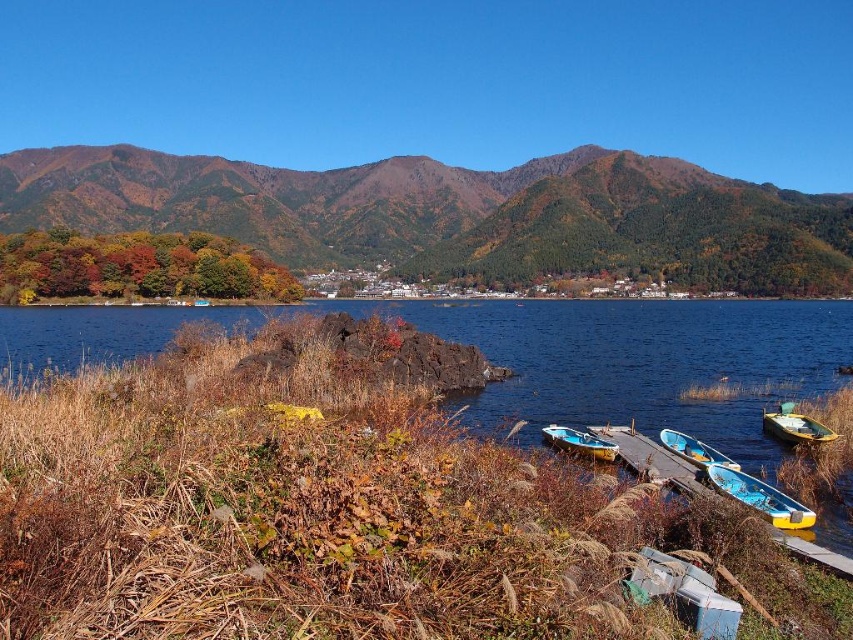
Who is more distant from viewer, (782, 497) or (660, 429)?

The point (660, 429) is more distant.

Is blue glossy canoe at lower right to the right of blue painted wooden canoe at lower center from the viewer's perspective?

No, blue glossy canoe at lower right is not to the right of blue painted wooden canoe at lower center.

Which is in front, point (746, 481) or point (694, 445)?

Point (746, 481)

The image size is (853, 640). What are the coordinates of `blue glossy canoe at lower right` in the screenshot? It's located at (759, 497).

Who is shorter, autumn foliage mountain at upper center or blue painted wooden canoe at lower center?

Standing shorter between the two is blue painted wooden canoe at lower center.

Is point (837, 218) farther from viewer compared to point (683, 456)?

Yes, it is.

Where is `autumn foliage mountain at upper center`? This screenshot has width=853, height=640. autumn foliage mountain at upper center is located at coordinates (456, 214).

Identify the location of autumn foliage mountain at upper center. [x=456, y=214].

Between point (790, 330) and point (697, 445), which one is positioned behind?

The point (790, 330) is more distant.

Can you confirm if blue water at lower center is smaller than blue painted wooden canoe at lower center?

Actually, blue water at lower center might be larger than blue painted wooden canoe at lower center.

Locate an element on the screen. The image size is (853, 640). blue water at lower center is located at coordinates (541, 356).

Image resolution: width=853 pixels, height=640 pixels. Identify the location of blue water at lower center. (541, 356).